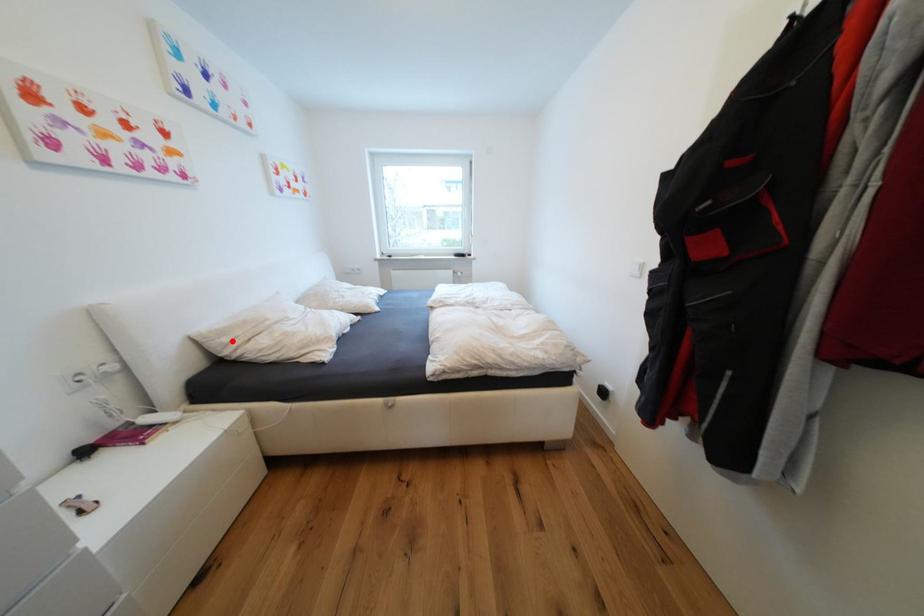
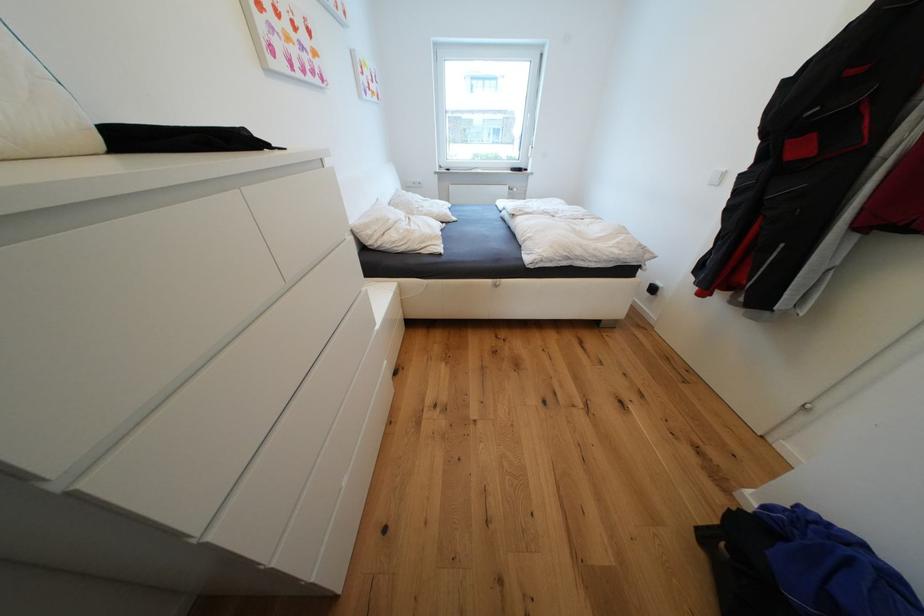
Question: I am providing you with two images of the same scene from different viewpoints. A red point is marked on the first image. At the location where the point appears in image 1, is it still visible in image 2?

Choices:
 (A) Yes
 (B) No

Answer: (A)